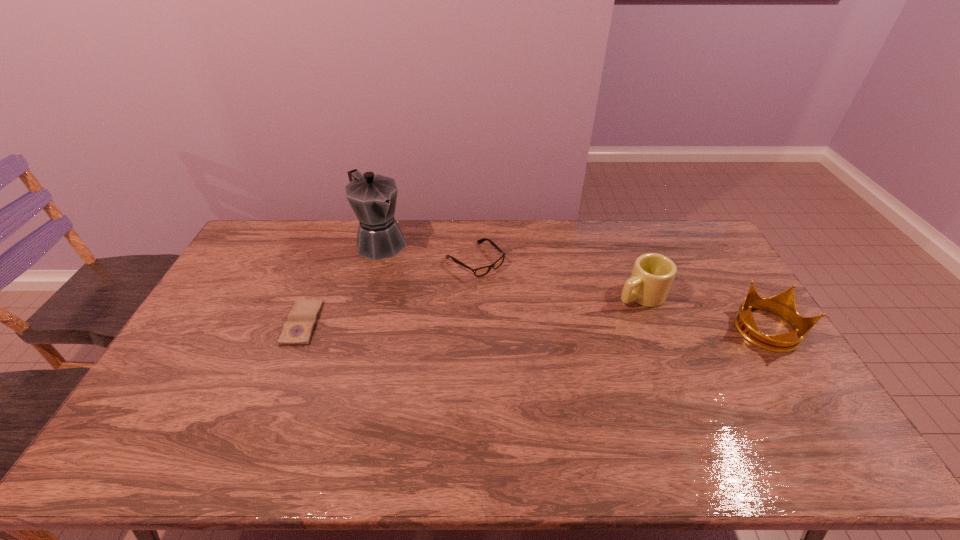
The height and width of the screenshot is (540, 960). I want to click on vacant space situated 0.180m with the handle on the side of the fourth object from left to right, so click(x=580, y=324).

Where is `vacant space situated 0.260m with the handle on the side of the fourth object from left to right`? vacant space situated 0.260m with the handle on the side of the fourth object from left to right is located at coordinates (560, 334).

This screenshot has width=960, height=540. Identify the location of vacant space situated 0.350m with the handle on the side of the fourth object from left to right. (536, 346).

Locate an element on the screen. vacant space located 0.180m on the front-facing side of the second shortest object is located at coordinates (529, 306).

Find the location of a particular element. The image size is (960, 540). vacant space located 0.390m on the front-facing side of the second shortest object is located at coordinates (576, 347).

This screenshot has height=540, width=960. Identify the location of vacant point located on the front-facing side of the second shortest object. (541, 317).

In order to click on vacant position located 0.180m at the spout of the tallest object in this screenshot , I will do pyautogui.click(x=421, y=281).

Where is `vacant area located at the spout of the tallest object`? This screenshot has height=540, width=960. vacant area located at the spout of the tallest object is located at coordinates (455, 313).

Identify the location of blank space located 0.110m at the spout of the tallest object. (411, 271).

This screenshot has height=540, width=960. Identify the location of spectacles present at the far edge. (479, 272).